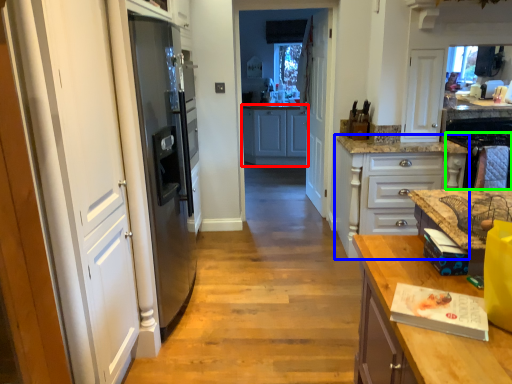
Question: Based on their relative distances, which object is farther from cabinetry (highlighted by a red box)? Choose from cabinetry (highlighted by a blue box) and oven (highlighted by a green box).

Choices:
 (A) cabinetry
 (B) oven

Answer: (B)